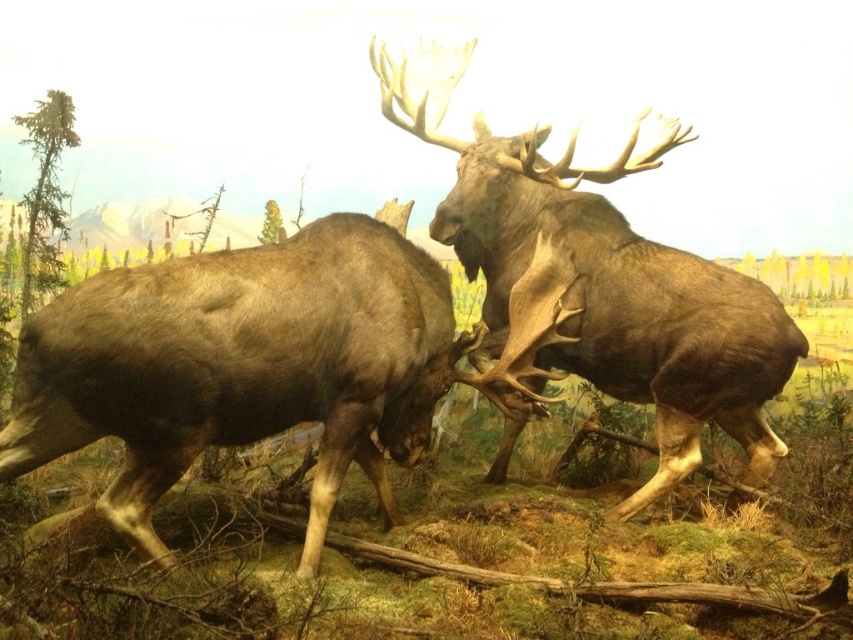
Is brown matte moose at center behind brown velvet moose at center?

That is False.

At what (x,y) coordinates should I click in order to perform the action: click on brown matte moose at center. Please return your answer as a coordinate pair (x, y). Looking at the image, I should click on (242, 365).